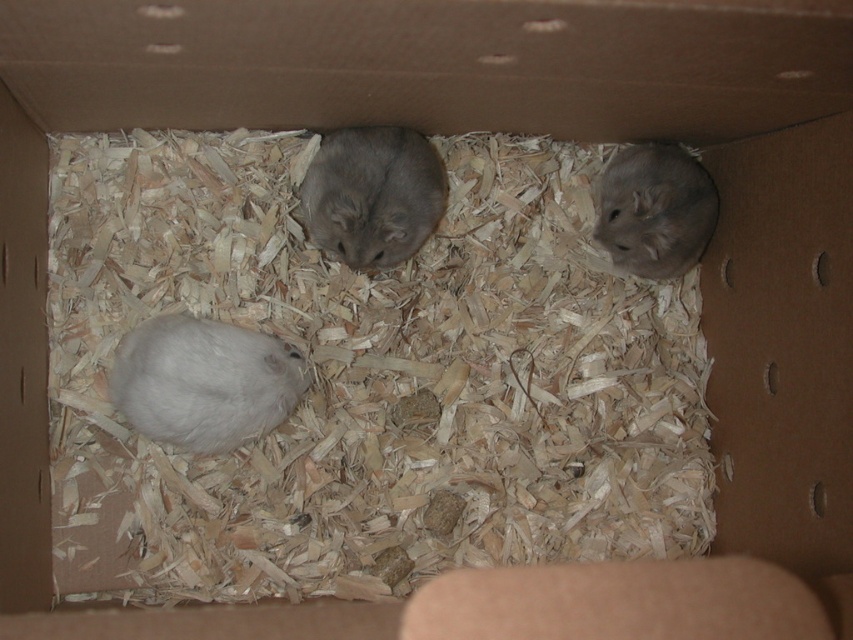
You are a veterinarian examining the hamsters in the cardboard box. You need to check the white fluffy mouse at lower left and the gray soft fur hamster at center. Which hamster should you check first to minimize disturbance?

You should check the white fluffy mouse at lower left first because it is closer to you than the gray soft fur hamster at center, so it would be less disruptive to reach the farther one after.

You are looking at the cardboard box with the hamsters. There are two points marked on the box. One is at coordinate point (140, 323) and the other is at point (614, 237). Which point is nearer to you?

Point (140, 323) is closer to the viewer than point (614, 237).